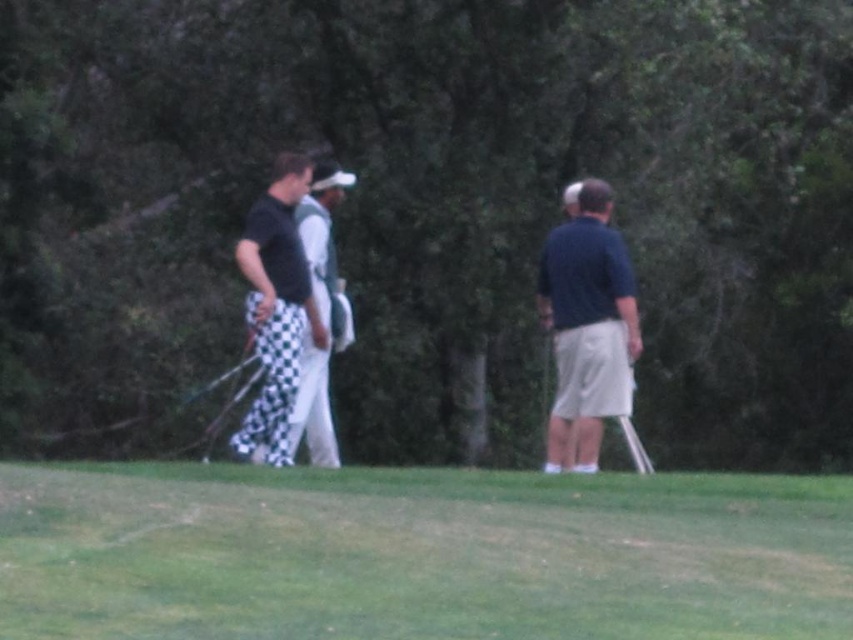
Question: Can you confirm if green grass at lower center is positioned above checkered pants at center?

Choices:
 (A) no
 (B) yes

Answer: (A)

Question: Which object appears farthest from the camera in this image?

Choices:
 (A) metallic silver golf club at right
 (B) white checkered pants at center
 (C) green grass at lower center
 (D) checkered pants at center

Answer: (A)

Question: Is green grass at lower center wider than metallic silver golf club at right?

Choices:
 (A) no
 (B) yes

Answer: (B)

Question: Among these points, which one is farthest from the camera?

Choices:
 (A) (585, 426)
 (B) (822, 634)
 (C) (631, 371)
 (D) (334, 312)

Answer: (D)

Question: Among these points, which one is farthest from the camera?

Choices:
 (A) (704, 624)
 (B) (252, 282)
 (C) (325, 349)

Answer: (C)

Question: Is green grass at lower center further to the viewer compared to metallic silver golf club at right?

Choices:
 (A) no
 (B) yes

Answer: (A)